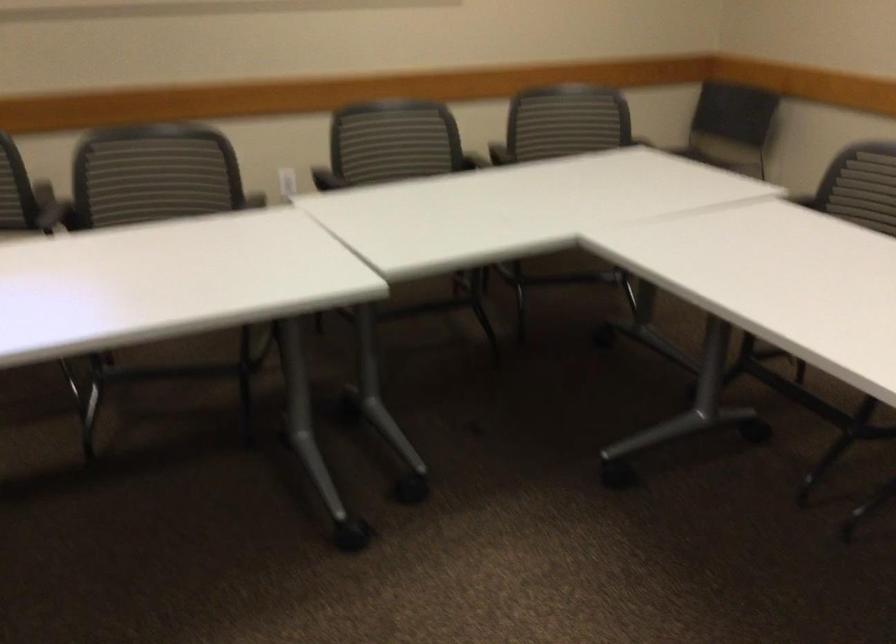
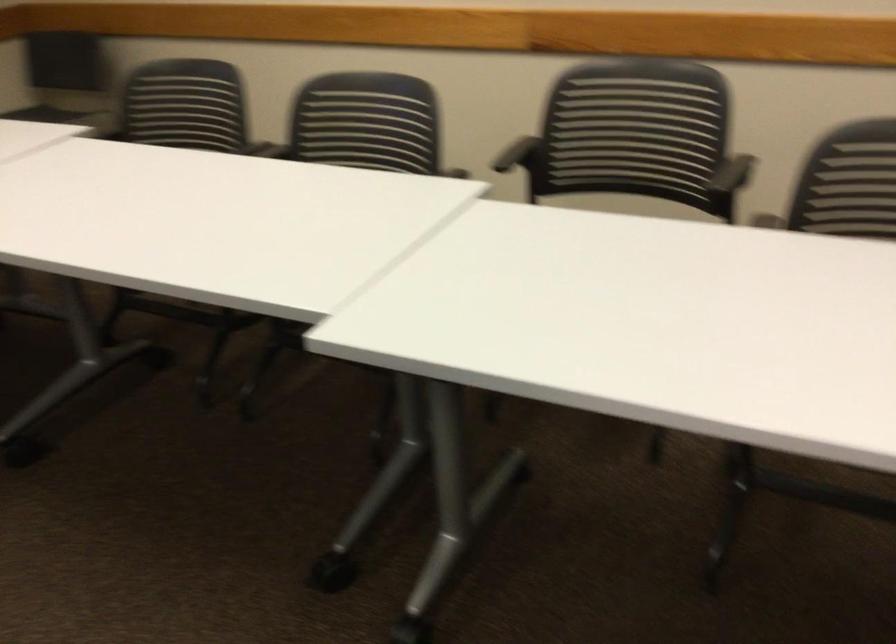
Question: The camera is either moving clockwise (left) or counter-clockwise (right) around the object. The first image is from the beginning of the video and the second image is from the end. Is the camera moving left or right when shooting the video?

Choices:
 (A) Left
 (B) Right

Answer: (A)